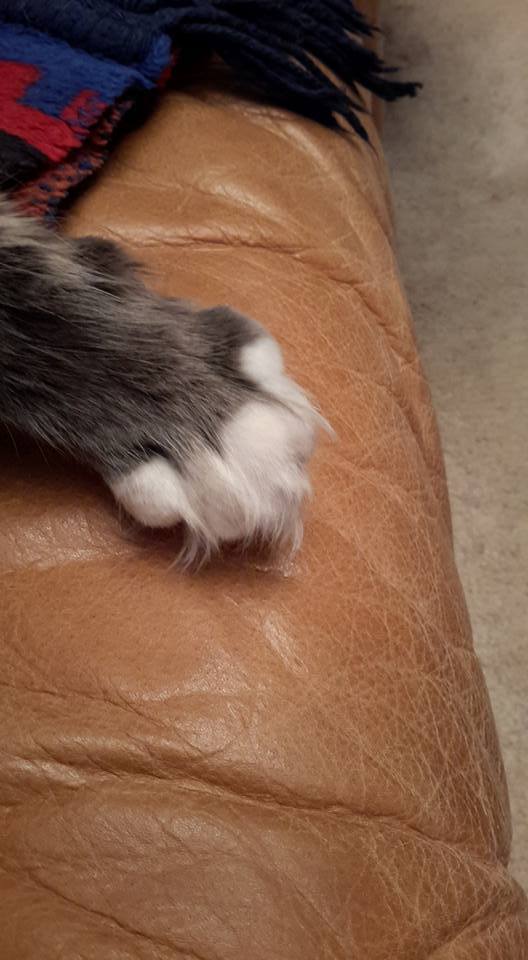
Image resolution: width=528 pixels, height=960 pixels. Identify the location of edge of couch. (462, 589).